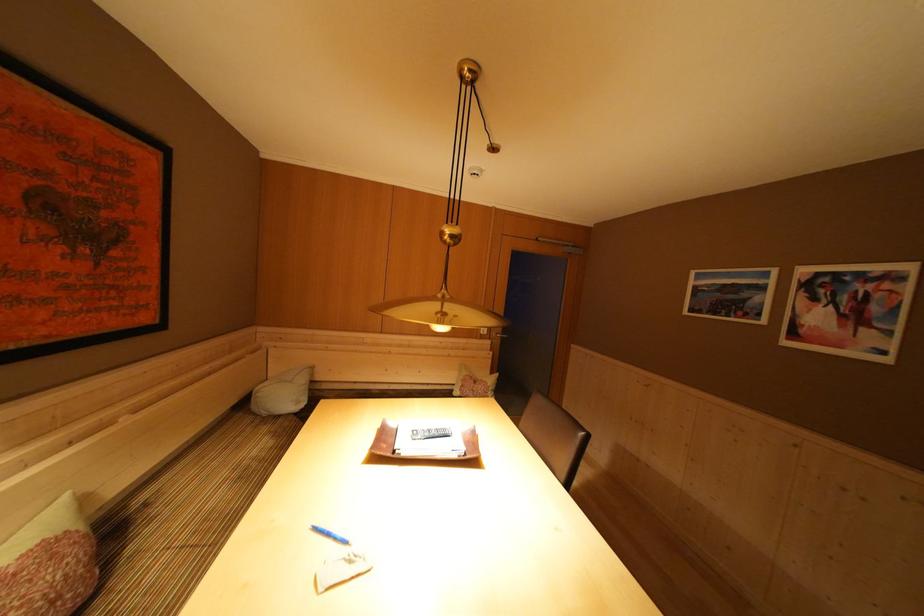
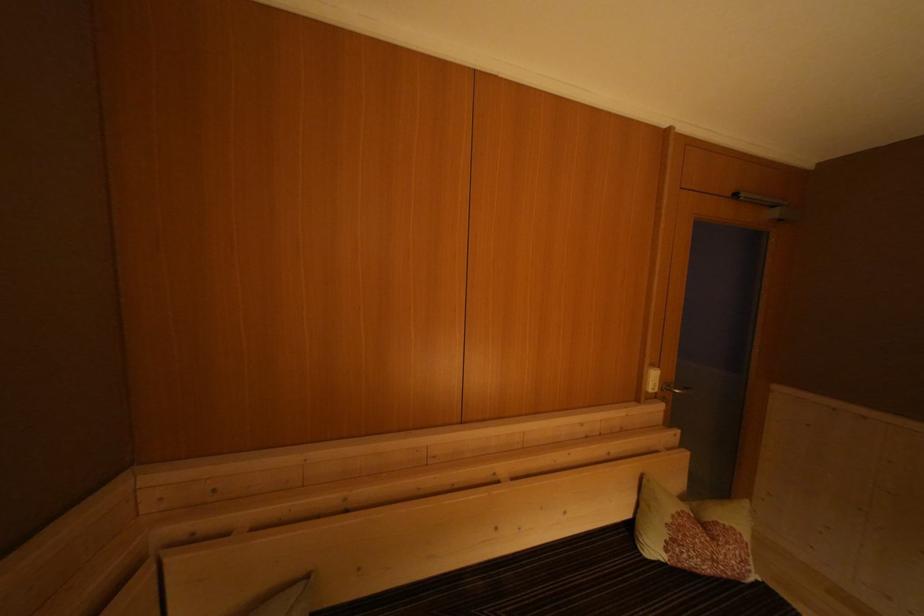
In a continuous first-person perspective shot, in which direction is the camera moving?

The cameraman moved toward left, forward.